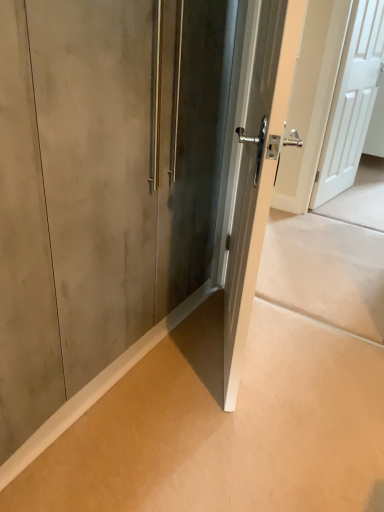
Question: Can you confirm if matte concrete wall at lower left is wider than white matte door at upper right, which ranks as the 2th door in front-to-back order?

Choices:
 (A) no
 (B) yes

Answer: (B)

Question: Are matte concrete wall at lower left and white matte door at upper right, the 1th door from the back, located far from each other?

Choices:
 (A) no
 (B) yes

Answer: (B)

Question: From the image's perspective, is matte concrete wall at lower left over white matte door at upper right, which ranks as the 2th door in front-to-back order?

Choices:
 (A) no
 (B) yes

Answer: (A)

Question: Is matte concrete wall at lower left to the left of white matte door at upper right, the 1th door from the back, from the viewer's perspective?

Choices:
 (A) yes
 (B) no

Answer: (A)

Question: From the image's perspective, is matte concrete wall at lower left under white matte door at upper right, which ranks as the 2th door in front-to-back order?

Choices:
 (A) yes
 (B) no

Answer: (A)

Question: From the image's perspective, is matte concrete wall at lower left above or below satin silver door at center, arranged as the 2th door when viewed from the right?

Choices:
 (A) below
 (B) above

Answer: (A)

Question: Based on their sizes in the image, would you say matte concrete wall at lower left is bigger or smaller than satin silver door at center, placed as the 1th door when sorted from left to right?

Choices:
 (A) big
 (B) small

Answer: (B)

Question: In the image, is matte concrete wall at lower left on the left side or the right side of satin silver door at center, arranged as the 2th door when viewed from the right?

Choices:
 (A) left
 (B) right

Answer: (A)

Question: Considering their positions, is matte concrete wall at lower left located in front of or behind satin silver door at center, arranged as the 2th door when viewed from the right?

Choices:
 (A) behind
 (B) front

Answer: (B)

Question: From a real-world perspective, is white matte door at upper right, the 1th door viewed from the right, physically located above or below matte concrete wall at lower left?

Choices:
 (A) above
 (B) below

Answer: (A)

Question: Would you say white matte door at upper right, the 1th door from the back, is inside or outside matte concrete wall at lower left?

Choices:
 (A) inside
 (B) outside

Answer: (B)

Question: Is white matte door at upper right, the 1th door viewed from the right, to the left or to the right of matte concrete wall at lower left in the image?

Choices:
 (A) right
 (B) left

Answer: (A)

Question: Is white matte door at upper right, which ranks as the 2th door in front-to-back order, in front of or behind matte concrete wall at lower left in the image?

Choices:
 (A) front
 (B) behind

Answer: (B)

Question: From the image's perspective, is satin silver door at center, the 2th door positioned from the back, above or below matte concrete wall at lower left?

Choices:
 (A) below
 (B) above

Answer: (B)

Question: In terms of width, does satin silver door at center, the 2th door positioned from the back, look wider or thinner when compared to matte concrete wall at lower left?

Choices:
 (A) thin
 (B) wide

Answer: (A)